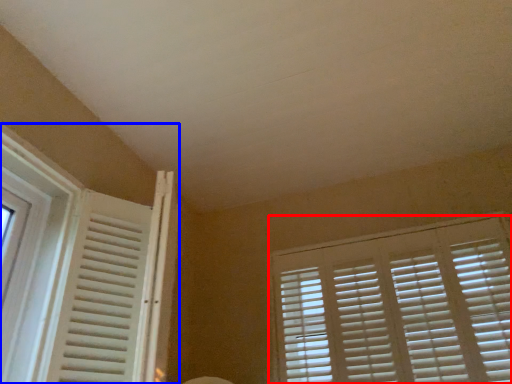
Question: Which object appears closest to the camera in this image, window blind (highlighted by a red box) or window (highlighted by a blue box)?

Choices:
 (A) window blind
 (B) window

Answer: (B)